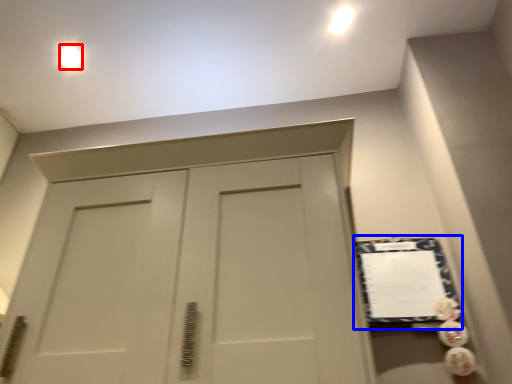
Question: Which object appears farthest to the camera in this image, lighting (highlighted by a red box) or bulletin board (highlighted by a blue box)?

Choices:
 (A) lighting
 (B) bulletin board

Answer: (A)